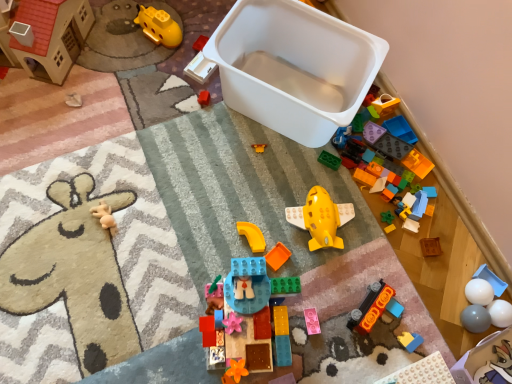
Locate an element on the screen. This screenshot has height=384, width=512. vacant space that is in between white plastic storage box at upper center, the 2th storage box in the right-to-left sequence, and beige rubber bear at left, which ranks as the 15th toy in right-to-left order is located at coordinates (200, 167).